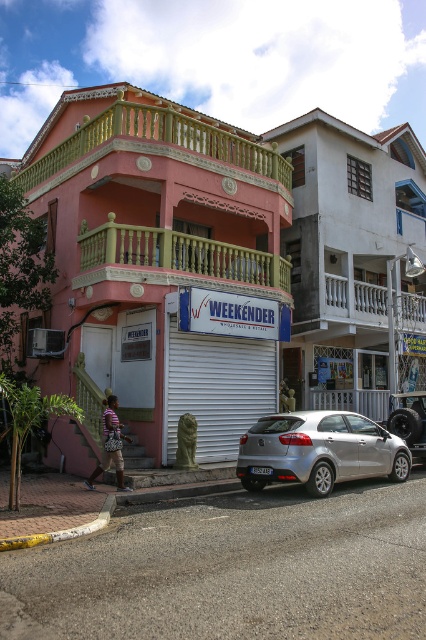
You are a pedestrian walking on the street and see the matte pink building at center and the striped fabric shirt at lower left. Which object is closer to you?

The striped fabric shirt at lower left is behind the matte pink building at center, so the matte pink building at center is closer to you.